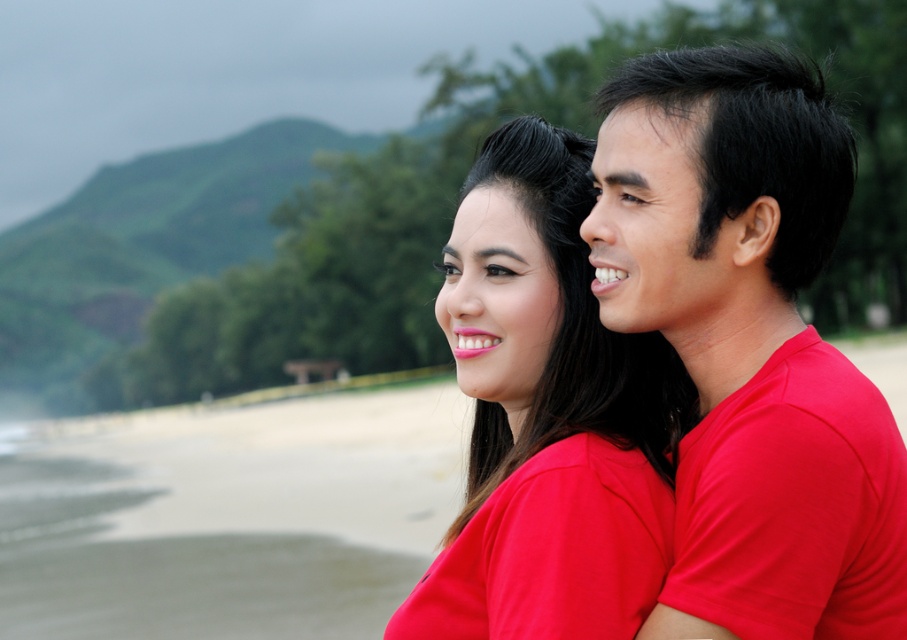
Question: Is matte red t-shirt at right closer to the viewer compared to matte red shirt at center?

Choices:
 (A) no
 (B) yes

Answer: (B)

Question: Which point is farther from the camera taking this photo?

Choices:
 (A) (861, 563)
 (B) (584, 168)

Answer: (B)

Question: Is matte red t-shirt at right wider than matte red shirt at center?

Choices:
 (A) yes
 (B) no

Answer: (B)

Question: Which point is farther to the camera?

Choices:
 (A) matte red t-shirt at right
 (B) matte red shirt at center

Answer: (B)

Question: Which point appears farthest from the camera in this image?

Choices:
 (A) (886, 531)
 (B) (588, 292)

Answer: (B)

Question: Does matte red t-shirt at right come in front of matte red shirt at center?

Choices:
 (A) yes
 (B) no

Answer: (A)